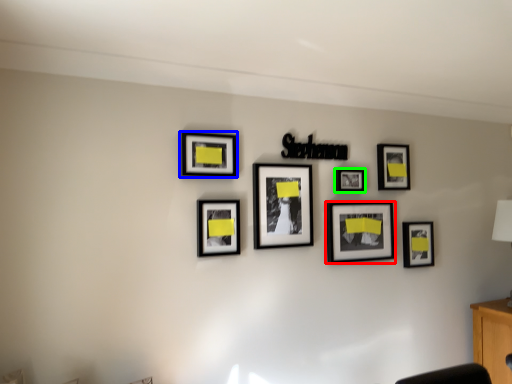
Question: Estimate the real-world distances between objects in this image. Which object is farther from picture frame (highlighted by a red box), picture frame (highlighted by a blue box) or picture frame (highlighted by a green box)?

Choices:
 (A) picture frame
 (B) picture frame

Answer: (A)